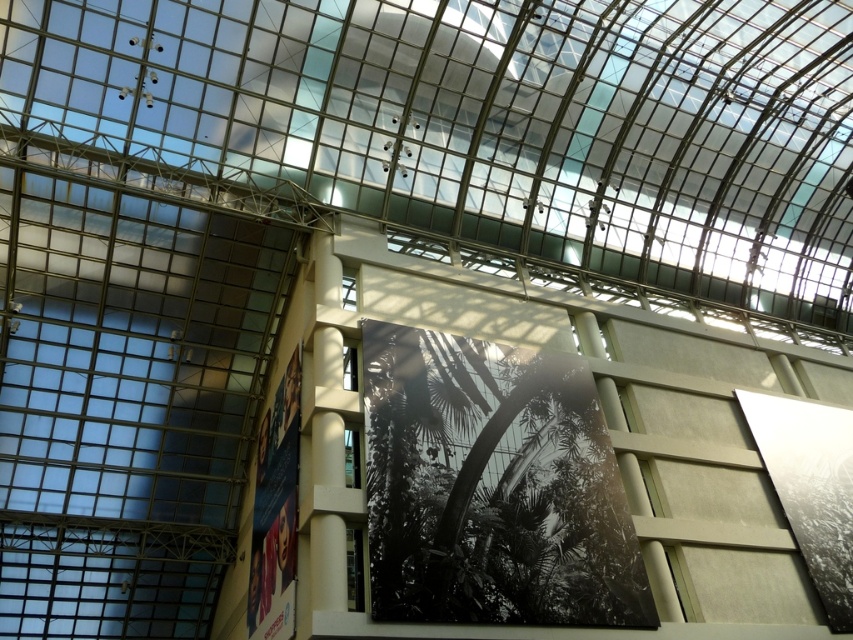
Can you confirm if transparent glass window at upper center is wider than transparent glass window at center?

No.

Can you confirm if transparent glass window at upper center is positioned to the left of transparent glass window at center?

Correct, you'll find transparent glass window at upper center to the left of transparent glass window at center.

Image resolution: width=853 pixels, height=640 pixels. I want to click on transparent glass window at upper center, so click(x=347, y=289).

Locate an element on the screen. This screenshot has height=640, width=853. transparent glass window at upper center is located at coordinates (347, 289).

Does clear glass window at center have a smaller size compared to transparent glass window at center?

No.

Is clear glass window at center taller than transparent glass window at center?

Indeed, clear glass window at center has a greater height compared to transparent glass window at center.

Is point (357, 456) more distant than point (347, 387)?

No, (357, 456) is closer to viewer.

You are a GUI agent. You are given a task and a screenshot of the screen. Output one action in this format:
    pyautogui.click(x=<x>, y=<y>)
    Task: Click on the clear glass window at center
    
    Given the screenshot: What is the action you would take?
    pyautogui.click(x=351, y=458)

Is transparent glass window at lower center bigger than transparent glass window at center?

Indeed, transparent glass window at lower center has a larger size compared to transparent glass window at center.

This screenshot has width=853, height=640. Find the location of `transparent glass window at lower center`. transparent glass window at lower center is located at coordinates (354, 568).